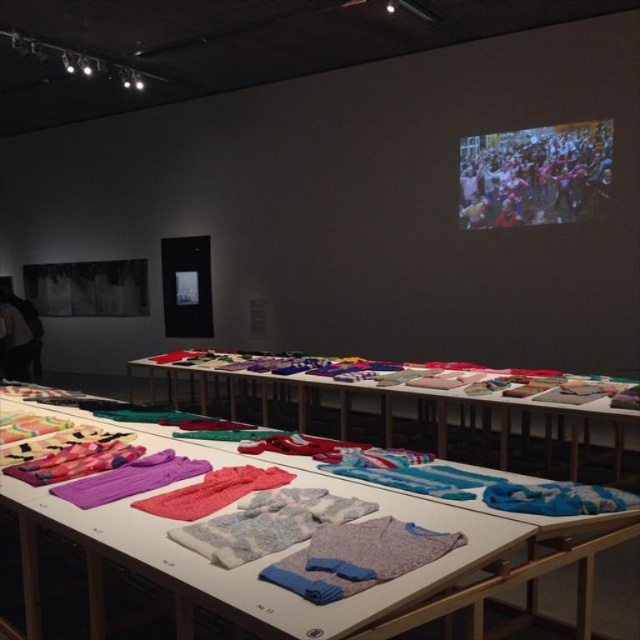
You are a fashion designer trying to arrange these items on a narrow shelf. The shelf can only accommodate items up to the width of the fluffy pink scarf at center. Can you fit the textured fabric shirts at center on the shelf without overlapping?

The textured fabric shirts at center might be wider than the fluffy pink scarf at center, so there is a possibility that they won not fit on the shelf if they exceed the scarf width.

What are the coordinates of the multicolored fabric at upper right?

The multicolored fabric at upper right is located at coordinates point (538, 172).

You are a visitor at the art exhibition and want to take a photo of both the textured fabric shirts at center and the fluffy pink scarf at center. Since you can only focus on one object at a time, which one should you position closer to the camera to ensure it stays in focus while the other is slightly blurred?

You should position the textured fabric shirts at center closer to the camera because it is to the left of the fluffy pink scarf at center, so adjusting focus on it will blur the scarf slightly.